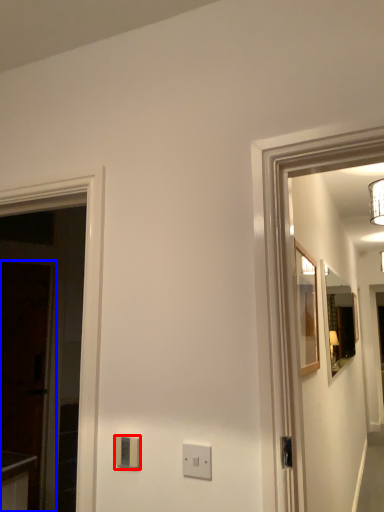
Question: Which object is further to the camera taking this photo, light switch (highlighted by a red box) or glass door (highlighted by a blue box)?

Choices:
 (A) light switch
 (B) glass door

Answer: (B)